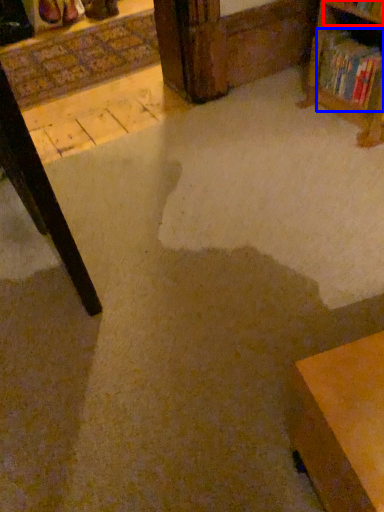
Question: Which object is closer to the camera taking this photo, shelf (highlighted by a red box) or book (highlighted by a blue box)?

Choices:
 (A) shelf
 (B) book

Answer: (A)